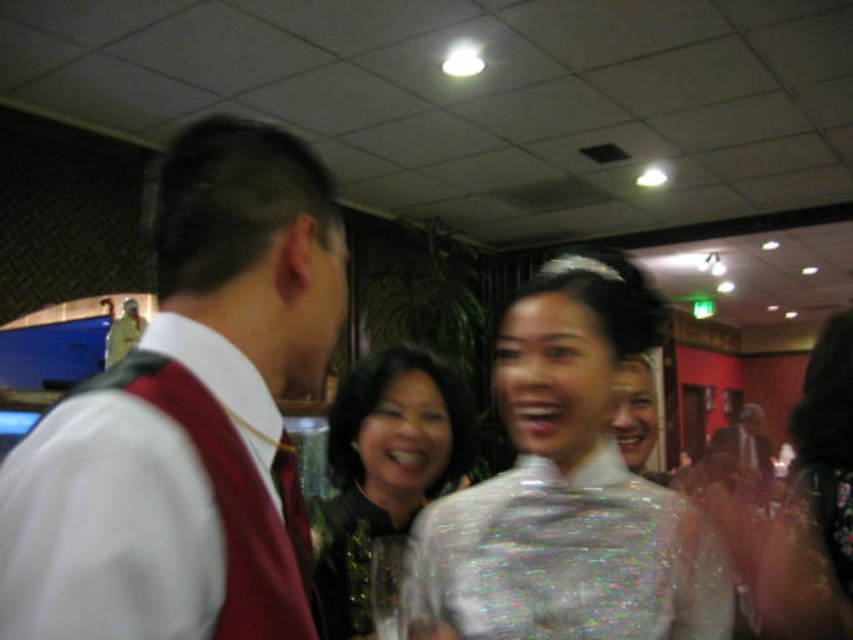
Between white sheer dress at center and silky black dress at center, which one appears on the right side from the viewer's perspective?

white sheer dress at center

The height and width of the screenshot is (640, 853). Describe the element at coordinates (567, 488) in the screenshot. I see `white sheer dress at center` at that location.

Does point (469, 561) come farther from viewer compared to point (363, 614)?

That is False.

Find the location of a particular element. The image size is (853, 640). white sheer dress at center is located at coordinates [567, 488].

Is matte red vest at left thinner than dark brown leather jacket at center?

Yes, matte red vest at left is thinner than dark brown leather jacket at center.

Can you confirm if matte red vest at left is positioned to the right of dark brown leather jacket at center?

No, matte red vest at left is not to the right of dark brown leather jacket at center.

Where is `matte red vest at left`? This screenshot has width=853, height=640. matte red vest at left is located at coordinates (189, 417).

Does matte white face at center appear on the left side of dark brown leather jacket at center?

Indeed, matte white face at center is positioned on the left side of dark brown leather jacket at center.

Is point (660, 428) behind point (763, 449)?

No.

What do you see at coordinates (637, 416) in the screenshot? Image resolution: width=853 pixels, height=640 pixels. I see `matte white face at center` at bounding box center [637, 416].

At what (x,y) coordinates should I click in order to perform the action: click on matte white face at center. Please return your answer as a coordinate pair (x, y). This screenshot has width=853, height=640. Looking at the image, I should click on (637, 416).